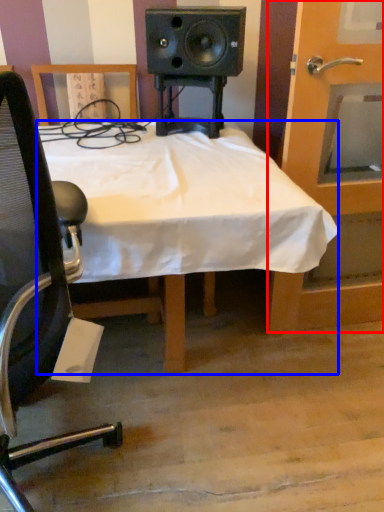
Question: Which point is further to the camera, door (highlighted by a red box) or desk (highlighted by a blue box)?

Choices:
 (A) door
 (B) desk

Answer: (A)